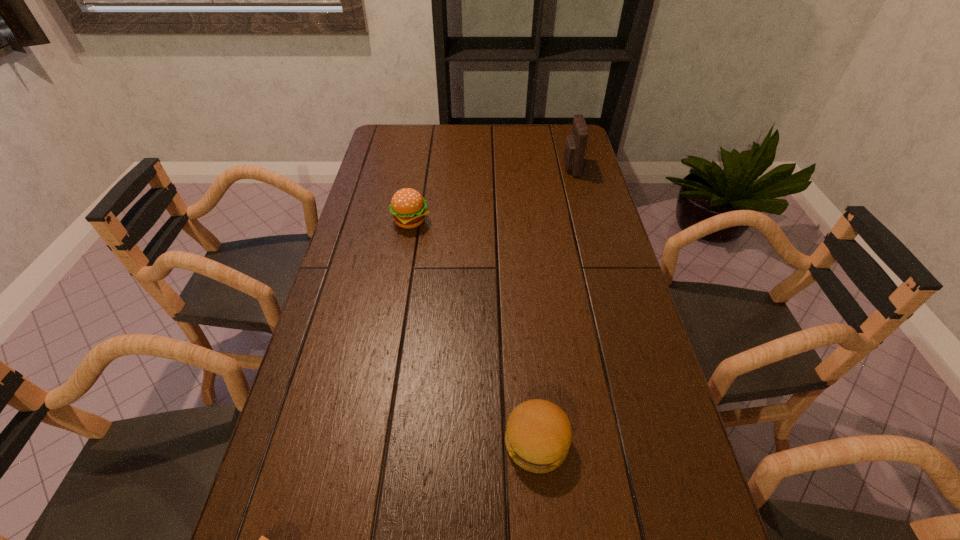
I want to click on the farthest object, so click(575, 144).

Image resolution: width=960 pixels, height=540 pixels. I want to click on pouch, so click(575, 144).

The height and width of the screenshot is (540, 960). Find the location of `the second hamburger from right to left`. the second hamburger from right to left is located at coordinates (408, 207).

Where is `the second farthest object`? the second farthest object is located at coordinates (408, 207).

This screenshot has height=540, width=960. I want to click on the rightmost hamburger, so 538,436.

Where is `the third tallest object`? The image size is (960, 540). the third tallest object is located at coordinates (538, 436).

In order to click on vacant space located 0.150m with an open flap on the farthest object in this screenshot , I will do `click(521, 167)`.

Where is `vacant space located 0.370m with an open flap on the farthest object`? The width and height of the screenshot is (960, 540). vacant space located 0.370m with an open flap on the farthest object is located at coordinates (461, 167).

Locate an element on the screen. This screenshot has width=960, height=540. free location located 0.300m with an open flap on the farthest object is located at coordinates (480, 167).

The height and width of the screenshot is (540, 960). Find the location of `vacant area located 0.180m on the back of the farthest hamburger`. vacant area located 0.180m on the back of the farthest hamburger is located at coordinates (419, 178).